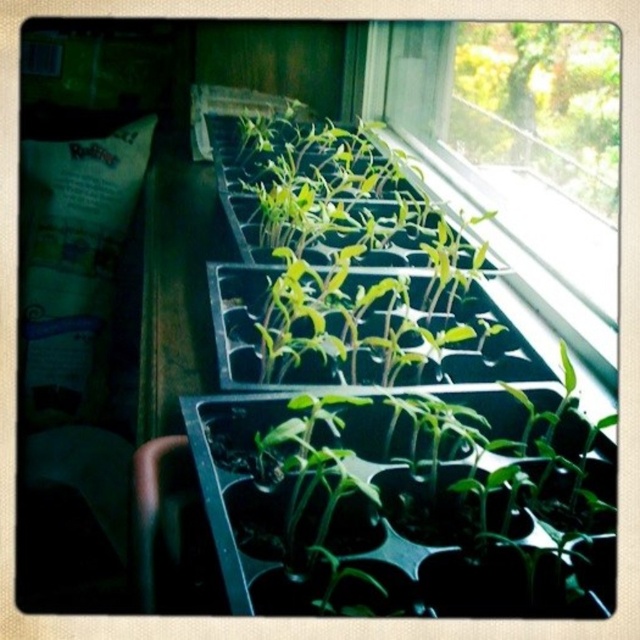
Is point (346, 186) more distant than point (460, 35)?

No, it is in front of (460, 35).

Can you confirm if green matte seedlings at center is bigger than transparent plastic tray of seedlings at upper right?

Yes.

Image resolution: width=640 pixels, height=640 pixels. Identify the location of green matte seedlings at center. (348, 262).

I want to click on green matte seedlings at center, so click(x=348, y=262).